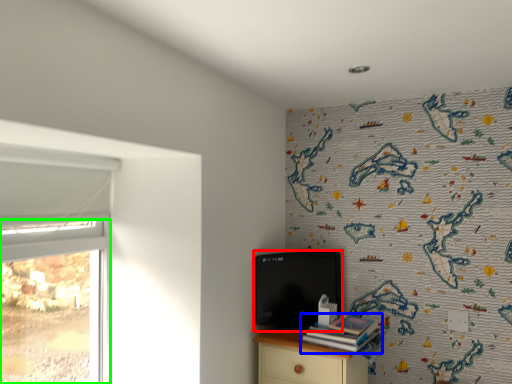
Question: Which object is the farthest from computer (highlighted by a red box)? Choose among these: book (highlighted by a blue box) or window (highlighted by a green box).

Choices:
 (A) book
 (B) window

Answer: (B)